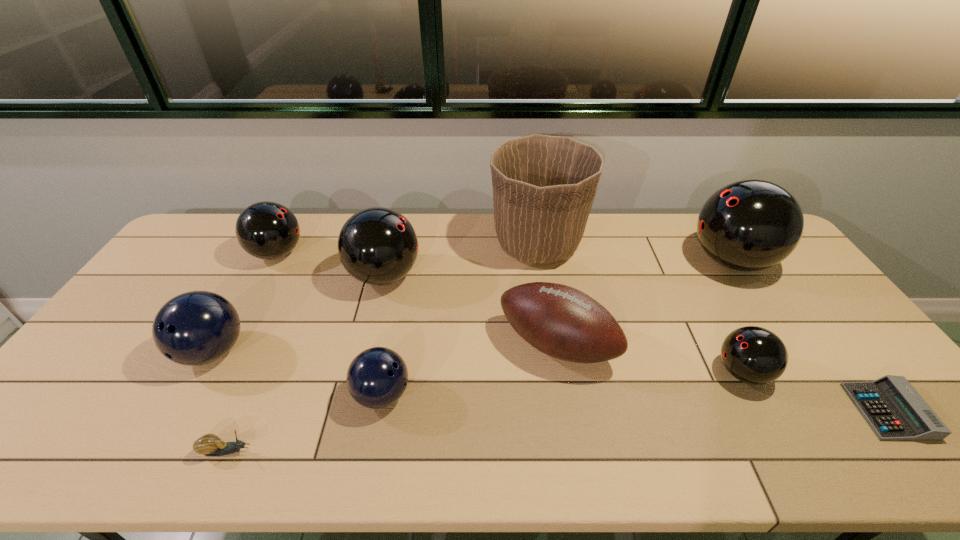
The height and width of the screenshot is (540, 960). In order to click on bowling ball that stands as the closest to the third tallest object in this screenshot , I will do `click(267, 230)`.

Identify which bowling ball is located as the third nearest to the smaller blue bowling ball. Please provide its 2D coordinates. Your answer should be formatted as a tuple, i.e. [(x, y)], where the tuple contains the x and y coordinates of a point satisfying the conditions above.

[(267, 230)]

At what (x,y) coordinates should I click in order to perform the action: click on black bowling ball that is the third closest one to the nearest object. Please return your answer as a coordinate pair (x, y). The width and height of the screenshot is (960, 540). Looking at the image, I should click on (754, 355).

I want to click on black bowling ball that is the nearest to the third black bowling ball from right to left, so click(x=267, y=230).

This screenshot has width=960, height=540. I want to click on vacant region that satisfies the following two spatial constraints: 1. on the surface of the second black bowling ball from left to right near the finger holes; 2. on the surface of the bigger blue bowling ball near the finger holes, so click(366, 352).

Image resolution: width=960 pixels, height=540 pixels. I want to click on free point that satisfies the following two spatial constraints: 1. on the back side of the brown football (American); 2. on the surface of the third smallest black bowling ball near the finger holes, so click(545, 276).

You are a GUI agent. You are given a task and a screenshot of the screen. Output one action in this format:
    pyautogui.click(x=<x>, y=<y>)
    Task: Click on the vacant area in the image that satisfies the following two spatial constraints: 1. on the surface of the second tallest bowling ball near the finger holes; 2. on the back side of the football (American)
    This screenshot has width=960, height=540.
    Given the screenshot: What is the action you would take?
    pyautogui.click(x=368, y=345)

The height and width of the screenshot is (540, 960). What are the coordinates of `free spot that satisfies the following two spatial constraints: 1. on the front side of the shortest object; 2. on the right side of the flowerpot` in the screenshot? It's located at (564, 411).

Locate an element on the screen. free location that satisfies the following two spatial constraints: 1. on the surface of the second smallest black bowling ball near the finger holes; 2. on the surface of the left blue bowling ball near the finger holes is located at coordinates (224, 352).